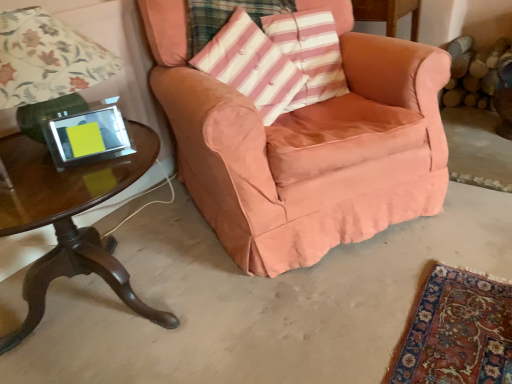
What are the coordinates of `pink striped fabric pillow at center` in the screenshot? It's located at (251, 66).

In order to face pink striped cushion at upper center, should I rotate leftwards or rightwards?

A 7.189 degree turn to the right will do.

Describe the element at coordinates (310, 53) in the screenshot. I see `pink striped cushion at upper center` at that location.

This screenshot has height=384, width=512. What are the coordinates of `suede-like peach armchair at center` in the screenshot? It's located at (306, 146).

Is shiny dark wood table at lower left turned away from pink striped cushion at upper center?

No.

Is shiny dark wood table at lower left positioned behind pink striped cushion at upper center?

No, the depth of shiny dark wood table at lower left is less than that of pink striped cushion at upper center.

Is shiny dark wood table at lower left taller or shorter than pink striped cushion at upper center?

Clearly, shiny dark wood table at lower left is taller compared to pink striped cushion at upper center.

Is point (151, 26) closer or farther from the camera than point (276, 76)?

Point (151, 26) is closer to the camera than point (276, 76).

Does suede-like peach armchair at center lie behind pink striped fabric pillow at center?

No, suede-like peach armchair at center is closer to the camera.

Is suede-like peach armchair at center wider or thinner than pink striped fabric pillow at center?

Considering their sizes, suede-like peach armchair at center looks broader than pink striped fabric pillow at center.

In terms of height, does suede-like peach armchair at center look taller or shorter compared to pink striped fabric pillow at center?

suede-like peach armchair at center is taller than pink striped fabric pillow at center.

Which object is closer to the camera, matte green lamp at left or pink striped cushion at upper center?

matte green lamp at left.

Can you tell me how much matte green lamp at left and pink striped cushion at upper center differ in facing direction?

34.6 degrees separate the facing orientations of matte green lamp at left and pink striped cushion at upper center.

Considering the relative sizes of matte green lamp at left and pink striped cushion at upper center in the image provided, is matte green lamp at left thinner than pink striped cushion at upper center?

→ In fact, matte green lamp at left might be wider than pink striped cushion at upper center.

Between matte green lamp at left and pink striped cushion at upper center, which one has smaller size?

With smaller size is pink striped cushion at upper center.

Is point (34, 156) less distant than point (37, 31)?

No, it is not.

Is shiny dark wood table at lower left not near matte green lamp at left?

No, shiny dark wood table at lower left is not far from matte green lamp at left.

Which is more to the right, shiny dark wood table at lower left or matte green lamp at left?

shiny dark wood table at lower left is more to the right.

From the image's perspective, which object appears higher, shiny dark wood table at lower left or matte green lamp at left?

matte green lamp at left appears higher in the image.

Consider the image. Based on their sizes in the image, would you say pink striped cushion at upper center is bigger or smaller than shiny dark wood table at lower left?

In the image, pink striped cushion at upper center appears to be smaller than shiny dark wood table at lower left.

Between pink striped cushion at upper center and shiny dark wood table at lower left, which one appears on the left side from the viewer's perspective?

shiny dark wood table at lower left is more to the left.

Is pink striped cushion at upper center positioned with its back to shiny dark wood table at lower left?

No, pink striped cushion at upper center is not facing the opposite direction of shiny dark wood table at lower left.

Which object is further away from the camera, pink striped cushion at upper center or shiny dark wood table at lower left?

pink striped cushion at upper center is further away from the camera.

Does point (343, 76) come in front of point (37, 18)?

No, it is not.

Can you confirm if pink striped cushion at upper center is taller than matte green lamp at left?

In fact, pink striped cushion at upper center may be shorter than matte green lamp at left.

How much distance is there between pink striped cushion at upper center and matte green lamp at left?

A distance of 32.69 inches exists between pink striped cushion at upper center and matte green lamp at left.

In the image, there is a pink striped cushion at upper center. At what (x,y) coordinates should I click in order to perform the action: click on lamp below it (from the image's perspective). Please return your answer as a coordinate pair (x, y). This screenshot has height=384, width=512. Looking at the image, I should click on pyautogui.click(x=47, y=58).

Between pink striped fabric pillow at center and matte green lamp at left, which one appears on the left side from the viewer's perspective?

Positioned to the left is matte green lamp at left.

How much distance is there between pink striped fabric pillow at center and matte green lamp at left?

pink striped fabric pillow at center is 23.07 inches away from matte green lamp at left.

Consider the image. Who is bigger, pink striped fabric pillow at center or matte green lamp at left?

matte green lamp at left is bigger.

Is pink striped fabric pillow at center inside the boundaries of matte green lamp at left, or outside?

pink striped fabric pillow at center is spatially situated outside matte green lamp at left.

At what (x,y) coordinates should I click in order to perform the action: click on table lying on the left of pink striped cushion at upper center. Please return your answer as a coordinate pair (x, y). The height and width of the screenshot is (384, 512). Looking at the image, I should click on (70, 219).

Where is `chair that is in front of the pink striped fabric pillow at center`? chair that is in front of the pink striped fabric pillow at center is located at coordinates (306, 146).

Looking at the image, which one is located closer to pink striped fabric pillow at center, shiny dark wood table at lower left or pink striped cushion at upper center?

pink striped cushion at upper center is closer to pink striped fabric pillow at center.

When comparing their distances from suede-like peach armchair at center, does pink striped fabric pillow at center or pink striped cushion at upper center seem closer?

pink striped fabric pillow at center is positioned closer to the anchor suede-like peach armchair at center.

From the image, which object appears to be farther from matte green lamp at left, shiny dark wood table at lower left or pink striped fabric pillow at center?

pink striped fabric pillow at center lies further to matte green lamp at left than the other object.

When comparing their distances from matte green lamp at left, does shiny dark wood table at lower left or suede-like peach armchair at center seem closer?

shiny dark wood table at lower left lies closer to matte green lamp at left than the other object.

Looking at the image, which one is located closer to shiny dark wood table at lower left, pink striped fabric pillow at center or suede-like peach armchair at center?

suede-like peach armchair at center lies closer to shiny dark wood table at lower left than the other object.

Looking at the image, which one is located closer to matte green lamp at left, pink striped cushion at upper center or shiny dark wood table at lower left?

shiny dark wood table at lower left.

Which object lies nearer to the anchor point matte green lamp at left, pink striped fabric pillow at center or suede-like peach armchair at center?

pink striped fabric pillow at center is closer to matte green lamp at left.

Based on their spatial positions, is pink striped cushion at upper center or shiny dark wood table at lower left closer to pink striped fabric pillow at center?

pink striped cushion at upper center.

Locate an element on the screen. The width and height of the screenshot is (512, 384). table between matte green lamp at left and suede-like peach armchair at center from left to right is located at coordinates (70, 219).

Find the location of a particular element. throw pillow located between shiny dark wood table at lower left and suede-like peach armchair at center in the left-right direction is located at coordinates (251, 66).

Find the location of a particular element. The height and width of the screenshot is (384, 512). table between matte green lamp at left and pink striped cushion at upper center from left to right is located at coordinates (70, 219).

At what (x,y) coordinates should I click in order to perform the action: click on throw pillow between suede-like peach armchair at center and pink striped cushion at upper center from front to back. Please return your answer as a coordinate pair (x, y). Looking at the image, I should click on (251, 66).